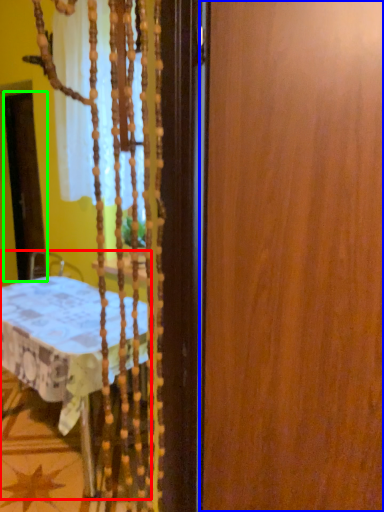
Question: Which is farther away from furniture (highlighted by a red box)? barn door (highlighted by a blue box) or screen door (highlighted by a green box)?

Choices:
 (A) barn door
 (B) screen door

Answer: (B)